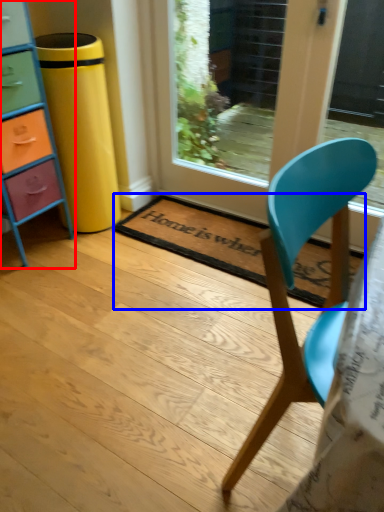
Question: Among these objects, which one is farthest to the camera, chest of drawers (highlighted by a red box) or mat (highlighted by a blue box)?

Choices:
 (A) chest of drawers
 (B) mat

Answer: (B)